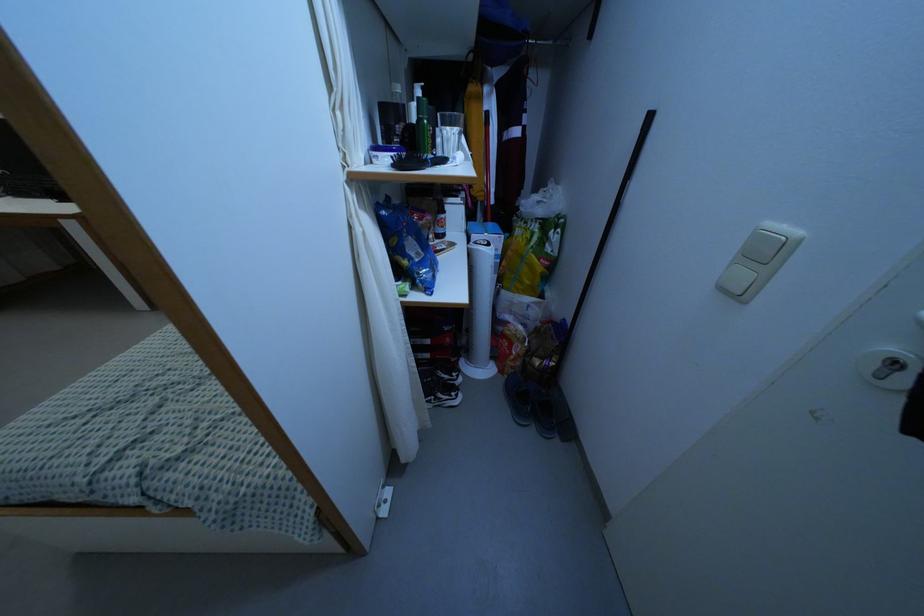
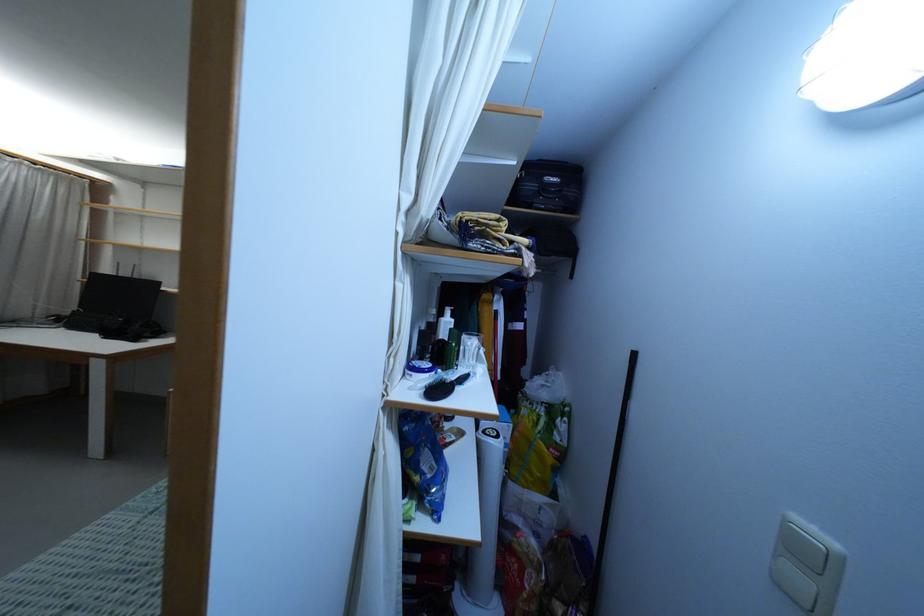
Where in the second image is the point corresponding to point (426, 159) from the first image?

(452, 382)